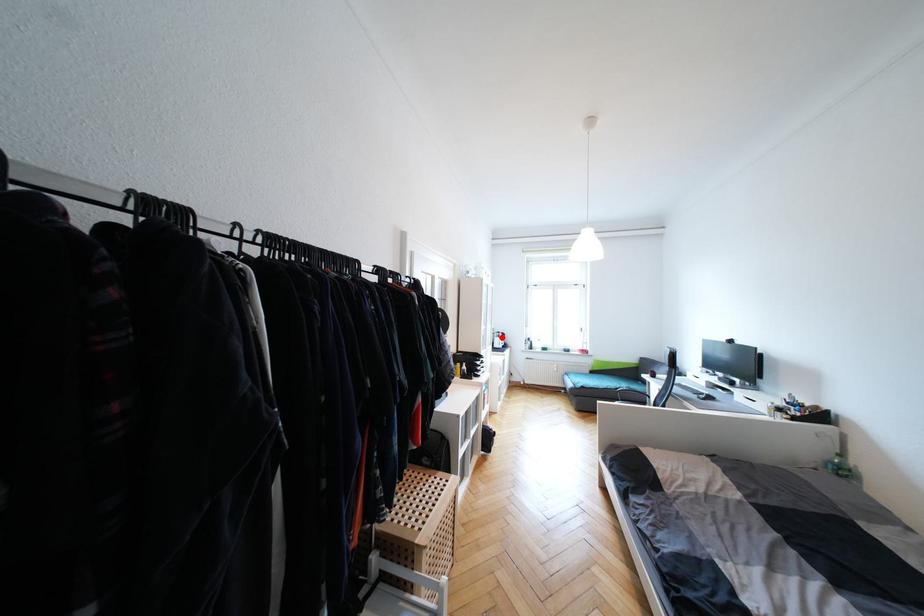
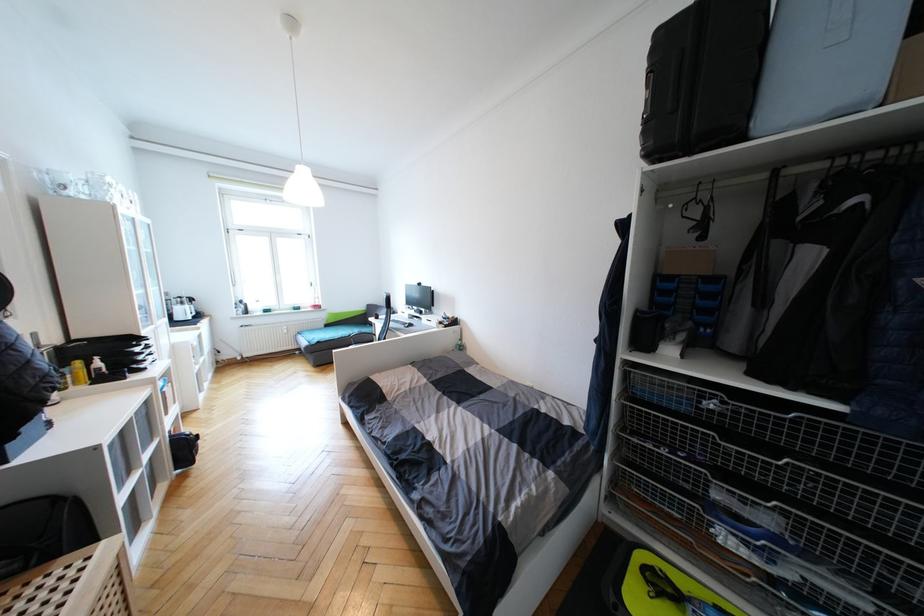
Where in the second image is the point corresponding to the highlighted location from the first image?

(186, 305)